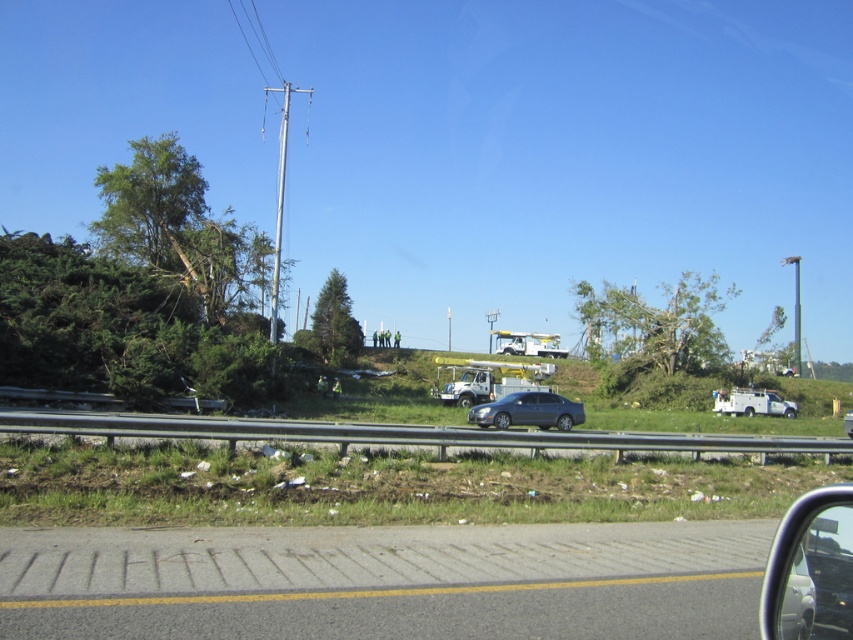
Does green leafy tree at left come in front of green matte tree at center?

Yes, green leafy tree at left is closer to the viewer.

Can you confirm if green leafy tree at left is wider than green matte tree at center?

Yes, green leafy tree at left is wider than green matte tree at center.

Find the location of a particular element. The width and height of the screenshot is (853, 640). green leafy tree at left is located at coordinates (180, 228).

Which is behind, point (659, 346) or point (473, 420)?

Positioned behind is point (659, 346).

Can you confirm if green leafy tree at center is positioned to the left of satin gray sedan at center?

Incorrect, green leafy tree at center is not on the left side of satin gray sedan at center.

Describe the element at coordinates (654, 328) in the screenshot. This screenshot has width=853, height=640. I see `green leafy tree at center` at that location.

You are a GUI agent. You are given a task and a screenshot of the screen. Output one action in this format:
    pyautogui.click(x=<x>, y=<y>)
    Task: Click on the green leafy tree at center
    This screenshot has height=640, width=853.
    Given the screenshot: What is the action you would take?
    pyautogui.click(x=654, y=328)

Is green leafy tree at center smaller than green matte tree at center?

No.

Is the position of green leafy tree at center more distant than that of green matte tree at center?

No.

Describe the element at coordinates (654, 328) in the screenshot. The width and height of the screenshot is (853, 640). I see `green leafy tree at center` at that location.

Where is `green leafy tree at center`? Image resolution: width=853 pixels, height=640 pixels. green leafy tree at center is located at coordinates (654, 328).